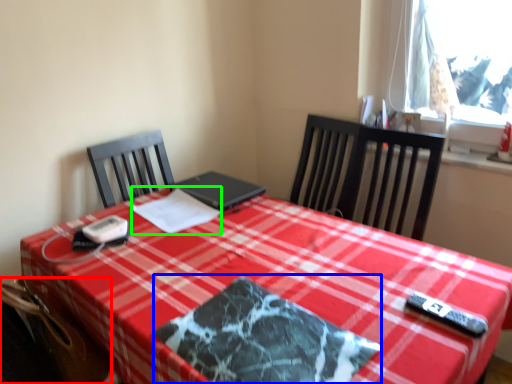
Question: Based on their relative distances, which object is nearer to swivel chair (highlighted by a red box)? Choose from place mat (highlighted by a blue box) and linen (highlighted by a green box).

Choices:
 (A) place mat
 (B) linen

Answer: (A)